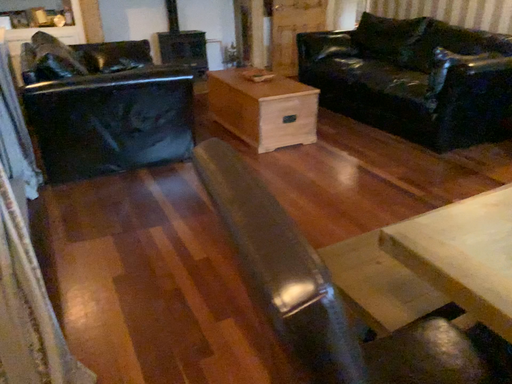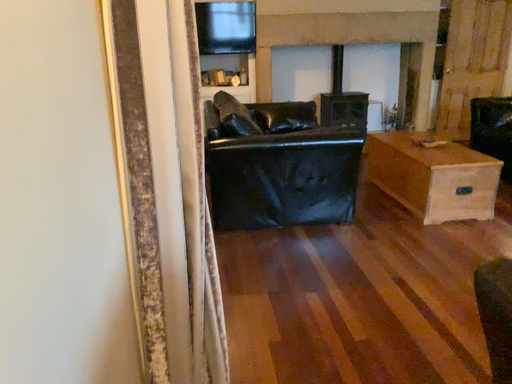
Question: Which way did the camera rotate in the video?

Choices:
 (A) rotated left
 (B) rotated right

Answer: (A)